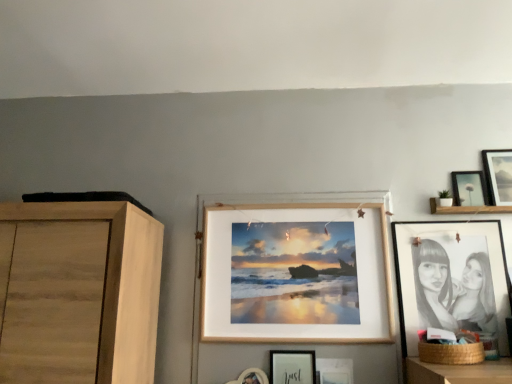
Question: From the image's perspective, is matte black picture frame at upper right, the 2th picture frame positioned from the right, located beneath wooden frame at center, arranged as the 2th picture frame when viewed from the left?

Choices:
 (A) no
 (B) yes

Answer: (A)

Question: From the image's perspective, is matte black picture frame at upper right, which is the fifth picture frame from left to right, located above wooden frame at center, arranged as the 2th picture frame when viewed from the left?

Choices:
 (A) no
 (B) yes

Answer: (B)

Question: Considering the relative sizes of matte black picture frame at upper right, which is the fifth picture frame from left to right, and wooden frame at center, positioned as the 5th picture frame in right-to-left order, in the image provided, is matte black picture frame at upper right, which is the fifth picture frame from left to right, bigger than wooden frame at center, positioned as the 5th picture frame in right-to-left order,?

Choices:
 (A) yes
 (B) no

Answer: (B)

Question: Considering the relative sizes of matte black picture frame at upper right, which is the fifth picture frame from left to right, and wooden frame at center, arranged as the 2th picture frame when viewed from the left, in the image provided, is matte black picture frame at upper right, which is the fifth picture frame from left to right, smaller than wooden frame at center, arranged as the 2th picture frame when viewed from the left,?

Choices:
 (A) yes
 (B) no

Answer: (A)

Question: Can you confirm if matte black picture frame at upper right, the 2th picture frame positioned from the right, is wider than wooden frame at center, arranged as the 2th picture frame when viewed from the left?

Choices:
 (A) yes
 (B) no

Answer: (B)

Question: Relative to black paper portrait at right, marked as the 3th picture frame in a right-to-left arrangement, is matte black picture frame at upper right, placed as the 6th picture frame when sorted from left to right, in front or behind?

Choices:
 (A) front
 (B) behind

Answer: (B)

Question: From the image's perspective, relative to black paper portrait at right, marked as the 3th picture frame in a right-to-left arrangement, is matte black picture frame at upper right, arranged as the 1th picture frame when viewed from the right, above or below?

Choices:
 (A) above
 (B) below

Answer: (A)

Question: Is point (498, 187) closer or farther from the camera than point (415, 350)?

Choices:
 (A) farther
 (B) closer

Answer: (A)

Question: Is matte black picture frame at upper right, placed as the 6th picture frame when sorted from left to right, wider or thinner than black paper portrait at right, acting as the fourth picture frame starting from the left?

Choices:
 (A) thin
 (B) wide

Answer: (A)

Question: From a real-world perspective, is matte wooden picture frame at center, marked as the fourth picture frame in a right-to-left arrangement, physically located above or below brown woven basket at lower right?

Choices:
 (A) below
 (B) above

Answer: (A)

Question: Is matte wooden picture frame at center, marked as the fourth picture frame in a right-to-left arrangement, taller or shorter than brown woven basket at lower right?

Choices:
 (A) tall
 (B) short

Answer: (A)

Question: In the image, is matte wooden picture frame at center, acting as the third picture frame starting from the left, positioned in front of or behind brown woven basket at lower right?

Choices:
 (A) front
 (B) behind

Answer: (B)

Question: Is matte wooden picture frame at center, marked as the fourth picture frame in a right-to-left arrangement, wider or thinner than brown woven basket at lower right?

Choices:
 (A) wide
 (B) thin

Answer: (B)

Question: Does point (345, 281) appear closer or farther from the camera than point (492, 150)?

Choices:
 (A) farther
 (B) closer

Answer: (B)

Question: Considering the positions of wooden frame at center, positioned as the 5th picture frame in right-to-left order, and matte black picture frame at upper right, placed as the 6th picture frame when sorted from left to right, in the image, is wooden frame at center, positioned as the 5th picture frame in right-to-left order, bigger or smaller than matte black picture frame at upper right, placed as the 6th picture frame when sorted from left to right,?

Choices:
 (A) big
 (B) small

Answer: (A)